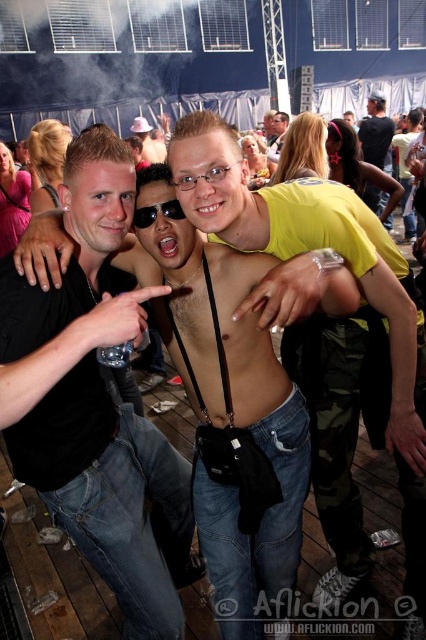
You are a photographer at the music festival and need to decide which item to place in your bag first. Given that the shiny black camera at center and the shiny black sunglasses at upper right are both in your view, which item is narrower so it can fit into the side pocket?

The shiny black camera at center is thinner than the shiny black sunglasses at upper right, so the camera can fit into the side pocket first.

You are a photographer at the music festival and need to choose between the shiny black camera at center and the shiny black sunglasses at upper right to put in your bag. Which item takes up less space?

The shiny black camera at center is smaller than the shiny black sunglasses at upper right, so it takes up less space.

You are a photographer at the music festival and want to take a photo of the crowd using your shiny black camera at center. However, you notice your black plastic sunglasses at center might block your view. Are the sunglasses in the way of the camera?

The shiny black camera at center is closer to the viewer than the black plastic sunglasses at center, so the sunglasses are behind the camera and would not block the view.